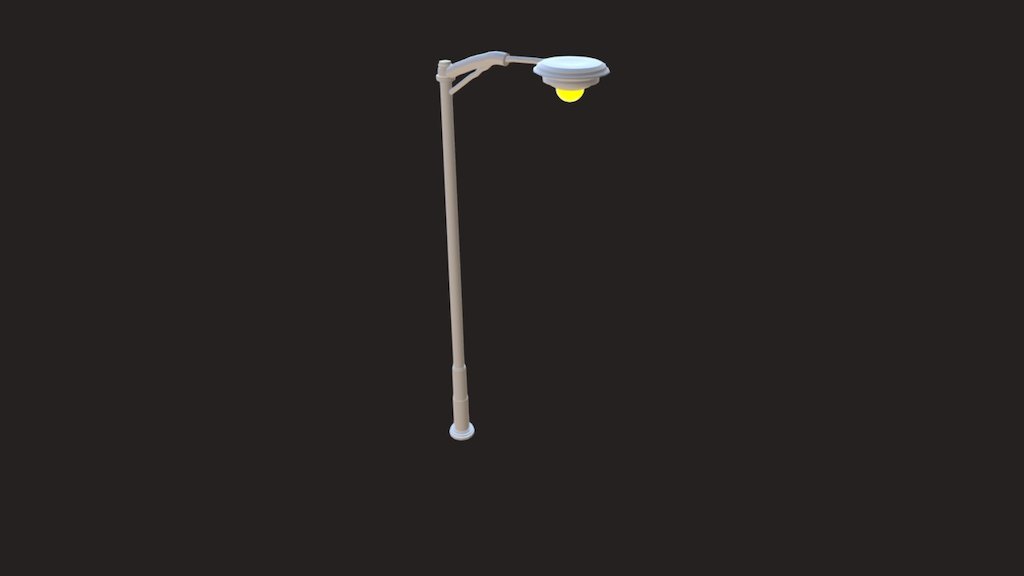
This screenshot has height=576, width=1024. What are the coordinates of `light bulb` in the screenshot? It's located at (571, 89).